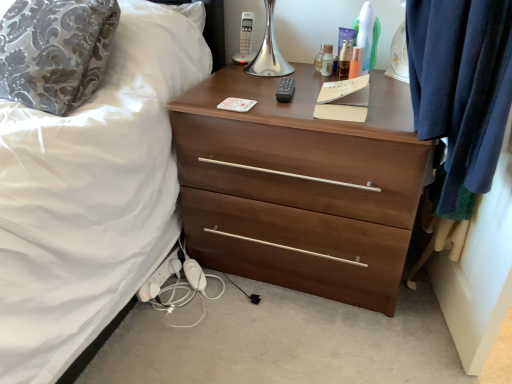
Question: In terms of size, does white plastic extension cord at lower left appear bigger or smaller than clear plastic bottle at upper center, the third toiletry viewed from the right?

Choices:
 (A) small
 (B) big

Answer: (B)

Question: Is point (165, 278) positioned closer to the camera than point (324, 74)?

Choices:
 (A) closer
 (B) farther

Answer: (B)

Question: Which object is the closest to the white plastic extension cord at lower left?

Choices:
 (A) brown wood chest of drawers at center
 (B) silky damask pillow at upper left
 (C) clear plastic bottle at upper center, positioned as the 1th toiletry in left-to-right order
 (D) clear plastic bottle at upper center, which is counted as the 2th toiletry, starting from the left
 (E) translucent plastic bottle at upper center, the 1th toiletry positioned from the right

Answer: (A)

Question: Which object is the farthest from the clear plastic bottle at upper center, positioned as the 1th toiletry in left-to-right order?

Choices:
 (A) clear plastic bottle at upper center, the third toiletry viewed from the right
 (B) white plastic extension cord at lower left
 (C) brown wood chest of drawers at center
 (D) silky damask pillow at upper left
 (E) translucent plastic bottles at upper right, the 3th toiletry in the left-to-right sequence

Answer: (B)